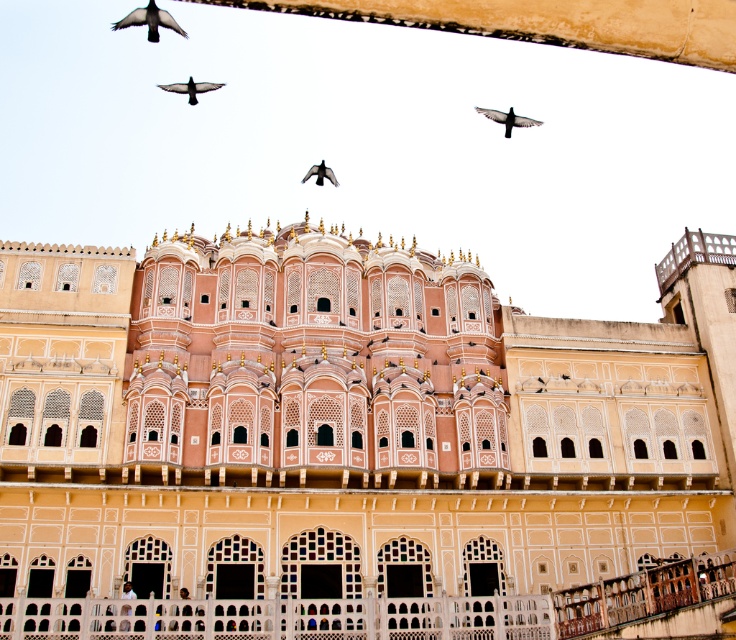
You are an ornithologist observing two birds perched on the roof of a historical palace. You notice a black matte bird at upper center and a black feathered pigeon at upper center. Which bird has a greater height?

The black matte bird at upper center is much taller than the black feathered pigeon at upper center.

You are standing in front of the grand architectural structure described in the scene. There is a specific point at coordinates point [353,444]. What object is located at that point?

The beige stone palace at center is located at point [353,444].